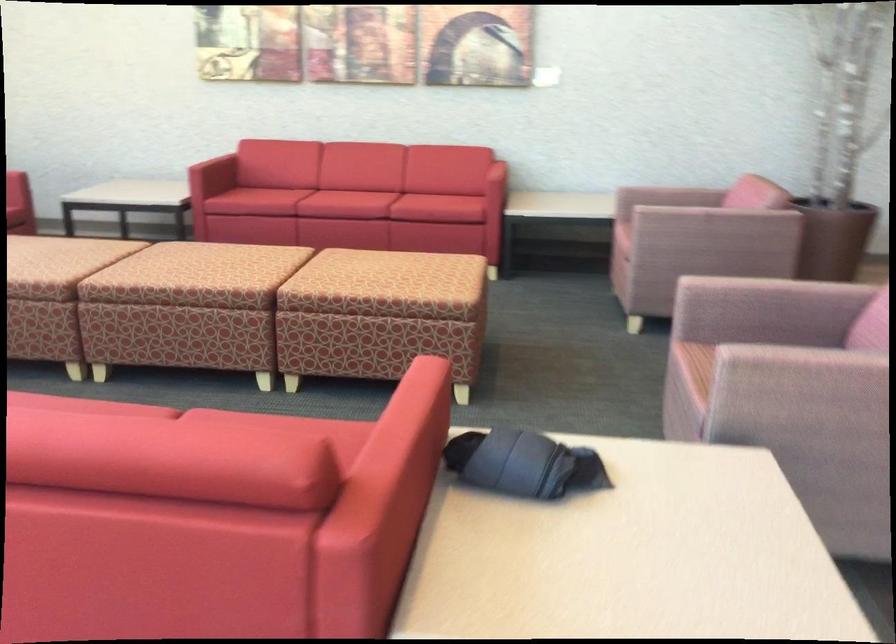
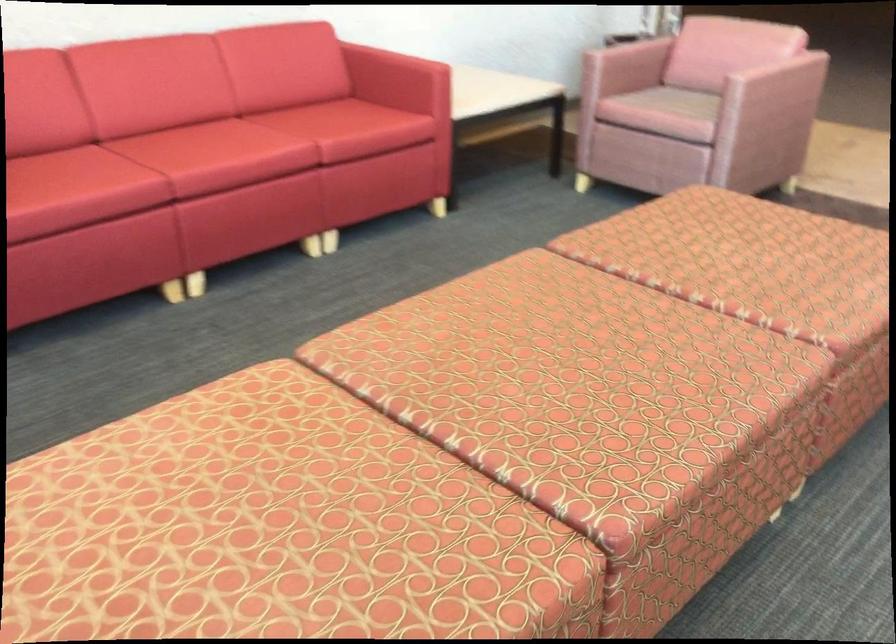
Where in the second image is the point corresponding to point 191,251 from the first image?

(549, 377)